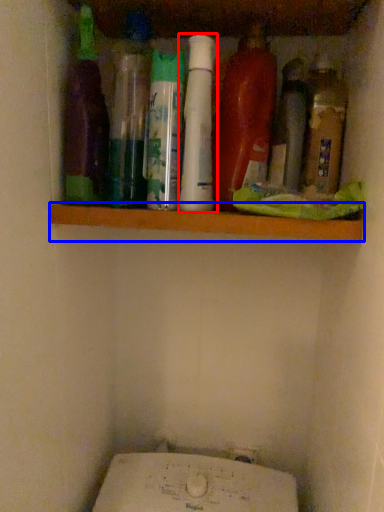
Question: Which object is closer to the camera taking this photo, bottle (highlighted by a red box) or ledge (highlighted by a blue box)?

Choices:
 (A) bottle
 (B) ledge

Answer: (A)